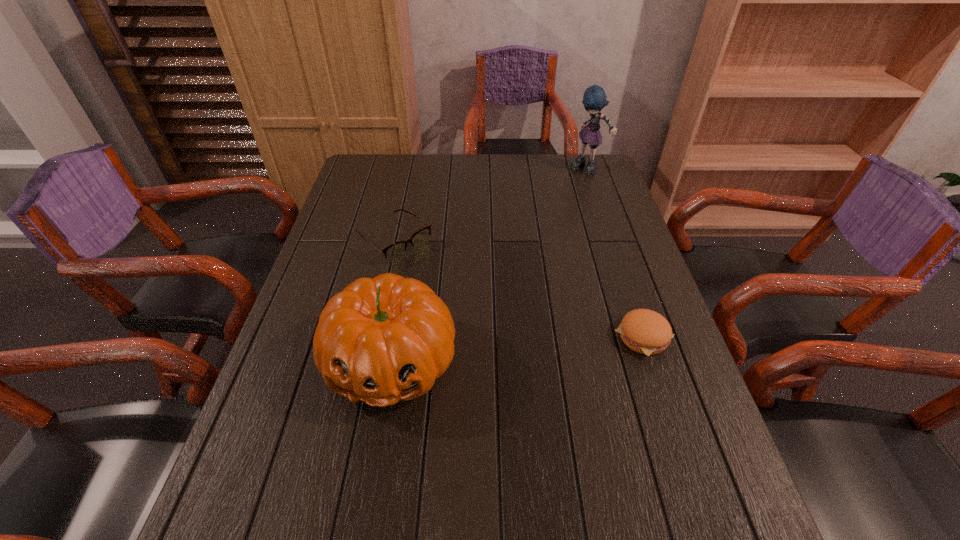
Locate an element on the screen. vacant space on the desktop that is between the third shortest object and the patty and is positioned on the face of the spectacles is located at coordinates (527, 348).

This screenshot has width=960, height=540. I want to click on free space on the desktop that is between the pumpkin and the patty and is positioned on the front-facing side of the rag doll, so click(x=501, y=350).